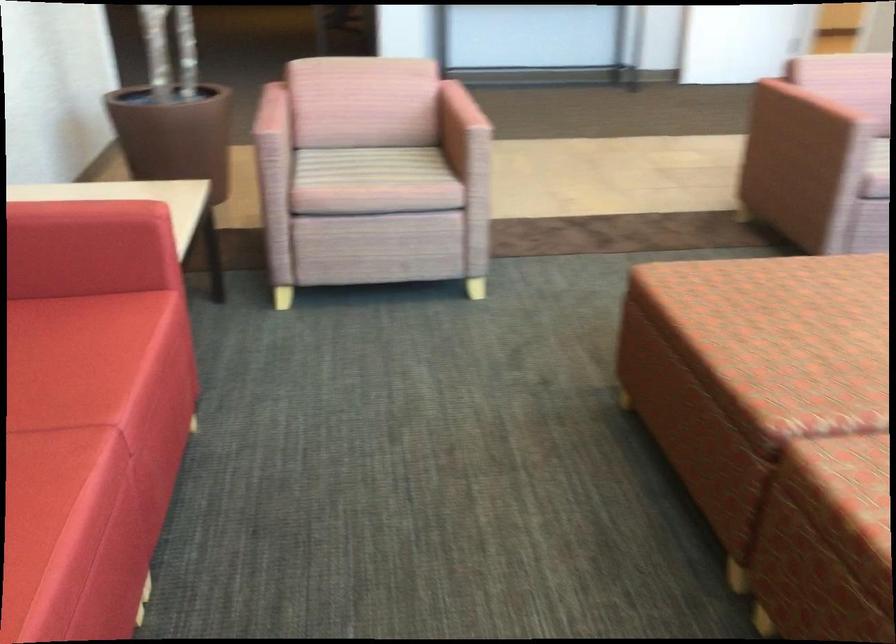
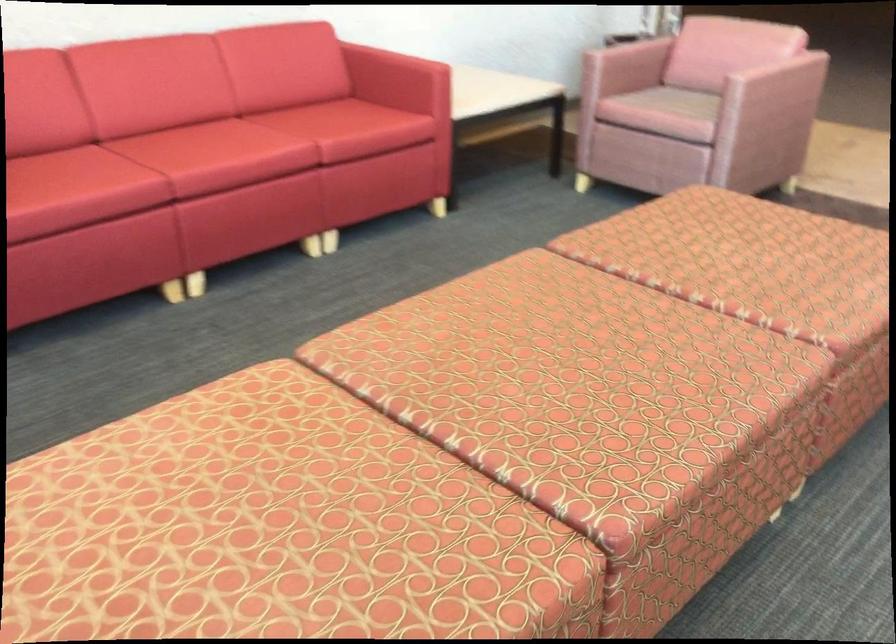
Find the pixel in the second image that matches pixel 373 163 in the first image.

(686, 102)